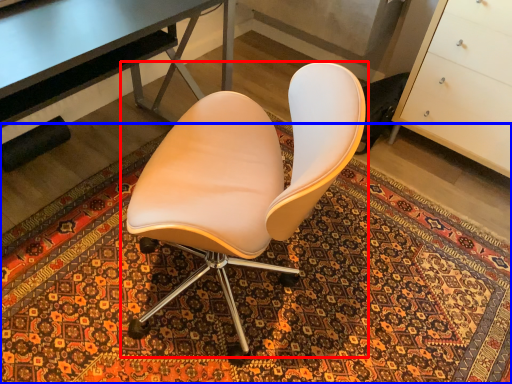
Question: Which object is further to the camera taking this photo, chair (highlighted by a red box) or mat (highlighted by a blue box)?

Choices:
 (A) chair
 (B) mat

Answer: (B)